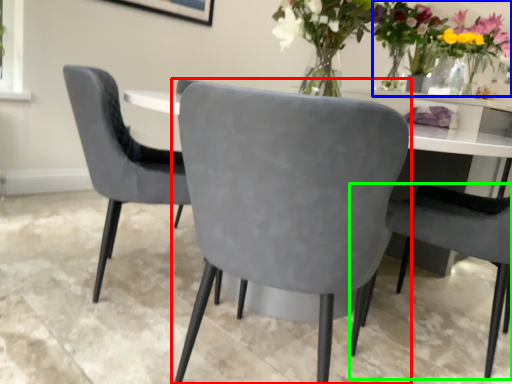
Question: Which object is the farthest from chair (highlighted by a red box)? Choose among these: floral arrangement (highlighted by a blue box) or chair (highlighted by a green box).

Choices:
 (A) floral arrangement
 (B) chair

Answer: (A)